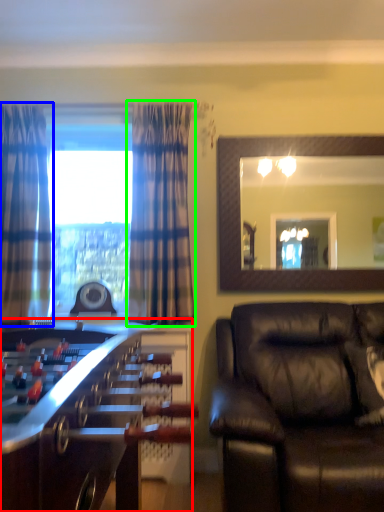
Question: Which is nearer to the table (highlighted by a red box)? curtain (highlighted by a blue box) or curtain (highlighted by a green box).

Choices:
 (A) curtain
 (B) curtain

Answer: (B)